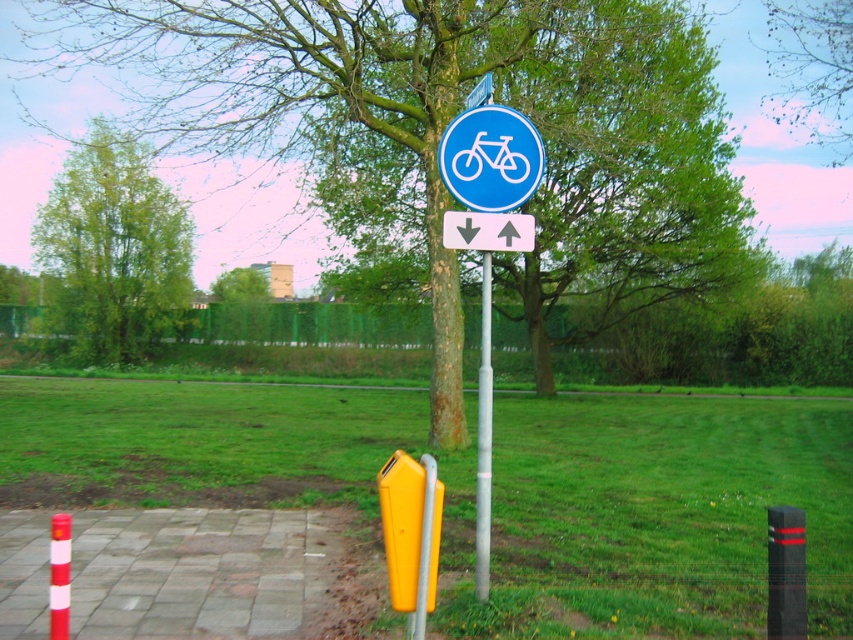
You are a cyclist navigating a bike lane and see the yellow plastic pole at lower center and the blue plastic bicycle sign at upper center. Which object is positioned to the left of the other?

The yellow plastic pole at lower center is to the left of blue plastic bicycle sign at upper center.

You are standing at the yellow parking meter on the left side of the path. Looking towards the green rough bark tree at center, which direction should you turn to face the blue circular sign with a white bicycle symbol mounted on a silver pole?

The blue circular sign with a white bicycle symbol mounted on a silver pole is located to the right of the green rough bark tree at center. Since you are facing the tree, turning to your right will orient you towards the sign.

You are a pedestrian standing on the pathway and want to reach the green rough bark tree at center. Which direction should you walk relative to the yellow plastic parking meter at lower center?

The green rough bark tree at center is above the yellow plastic parking meter at lower center, so you should walk forward towards the tree, which is located above the parking meter.